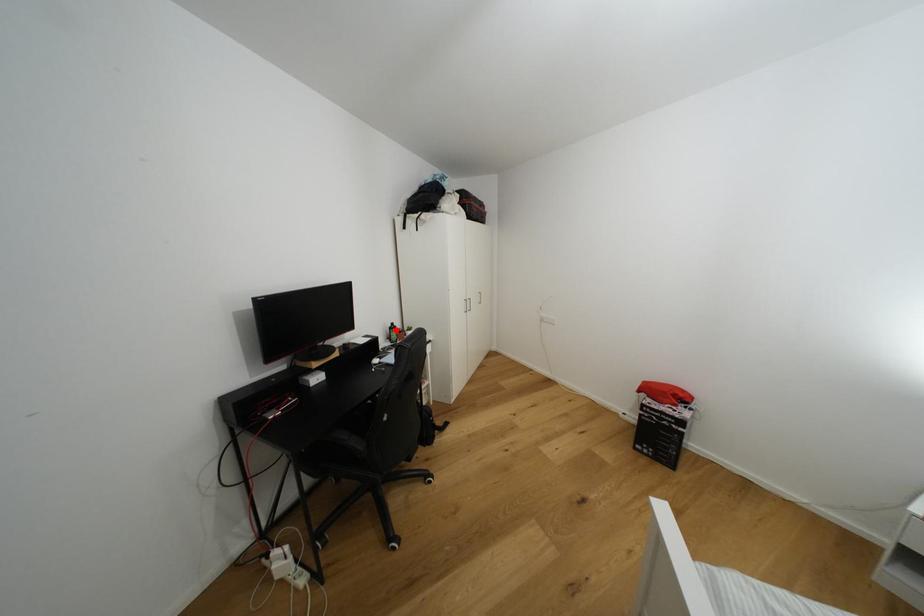
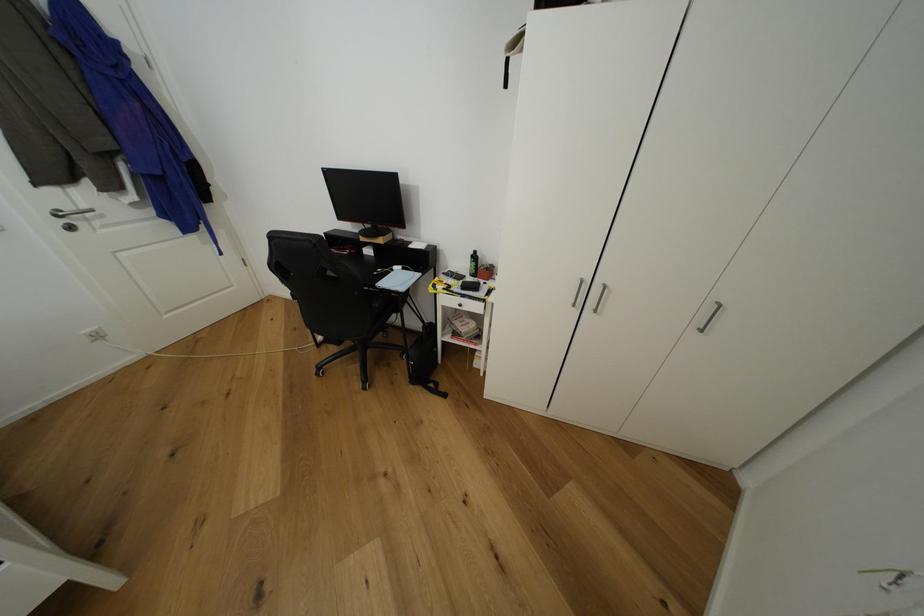
Question: I am providing you with two images of the same scene from different viewpoints. Image1 has a red point marked. In image2, the corresponding 3D location appears at what relative position? Reply with the corresponding letter.

Choices:
 (A) Closer
 (B) Farther

Answer: (A)